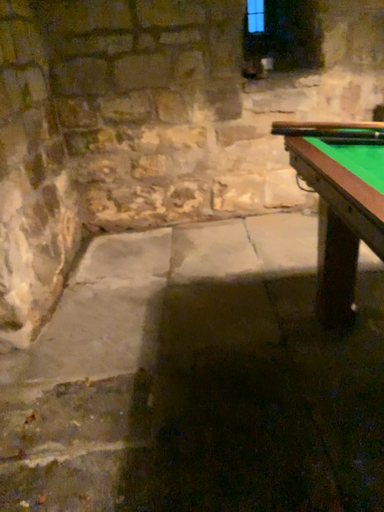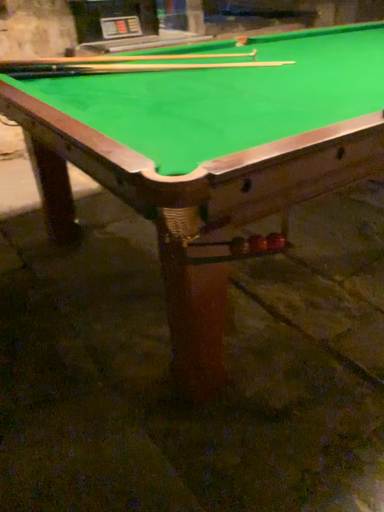
Question: How did the camera likely rotate when shooting the video?

Choices:
 (A) rotated right
 (B) rotated left

Answer: (A)